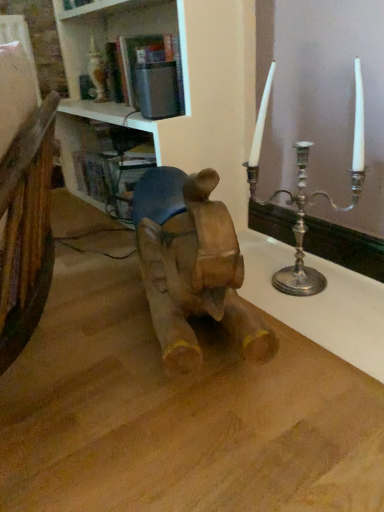
Question: Considering the positions of silver metallic candlestick at upper right and white glossy bookshelf at upper center in the image, is silver metallic candlestick at upper right wider or thinner than white glossy bookshelf at upper center?

Choices:
 (A) wide
 (B) thin

Answer: (B)

Question: Considering the positions of point (278, 34) and point (81, 58), is point (278, 34) closer or farther from the camera than point (81, 58)?

Choices:
 (A) closer
 (B) farther

Answer: (A)

Question: Which object is the closest to the silver metallic candlestick at upper right?

Choices:
 (A) white glossy bookshelf at upper center
 (B) silver metallic candle holder at right
 (C) wooden horse at center

Answer: (B)

Question: Considering the real-world distances, which object is farthest from the silver metallic candle holder at right?

Choices:
 (A) white glossy bookshelf at upper center
 (B) wooden horse at center
 (C) silver metallic candlestick at upper right

Answer: (A)